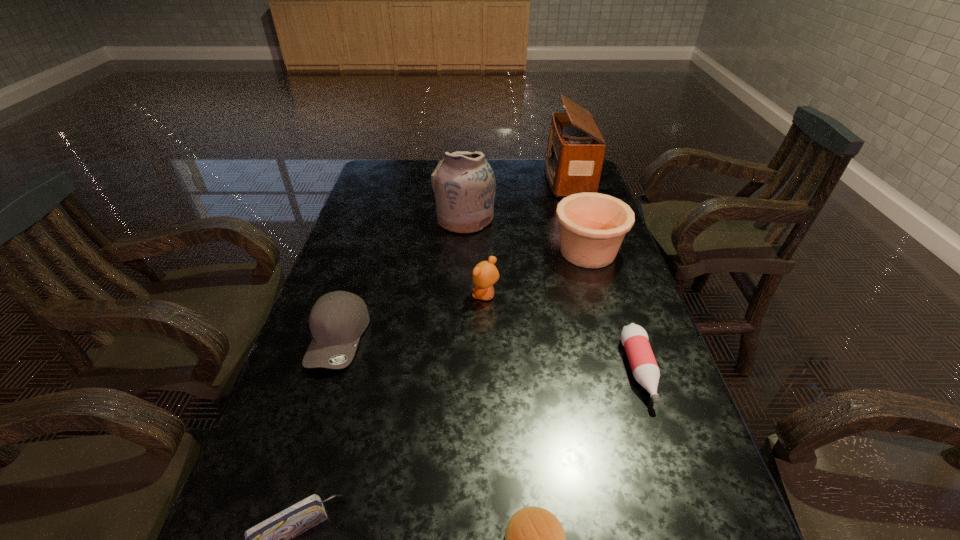
Locate an element on the screen. the closest object to the radio receiver is located at coordinates (592, 225).

Image resolution: width=960 pixels, height=540 pixels. In order to click on object that is the second closest to the fifth tallest object in this screenshot , I will do `click(271, 539)`.

Locate an element on the screen. This screenshot has height=540, width=960. vacant region that satisfies the following two spatial constraints: 1. on the face of the teddy bear; 2. on the front brim of the baseball cap is located at coordinates click(486, 338).